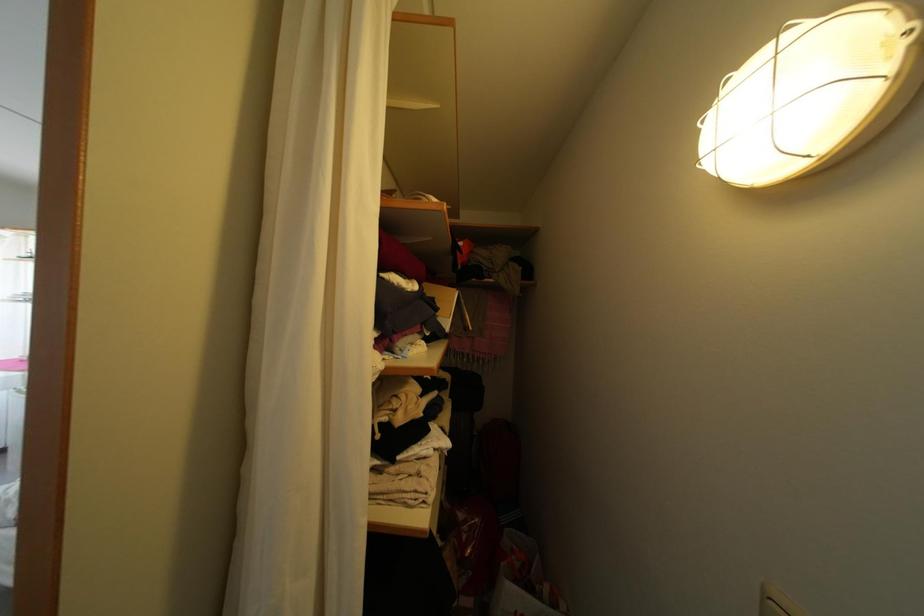
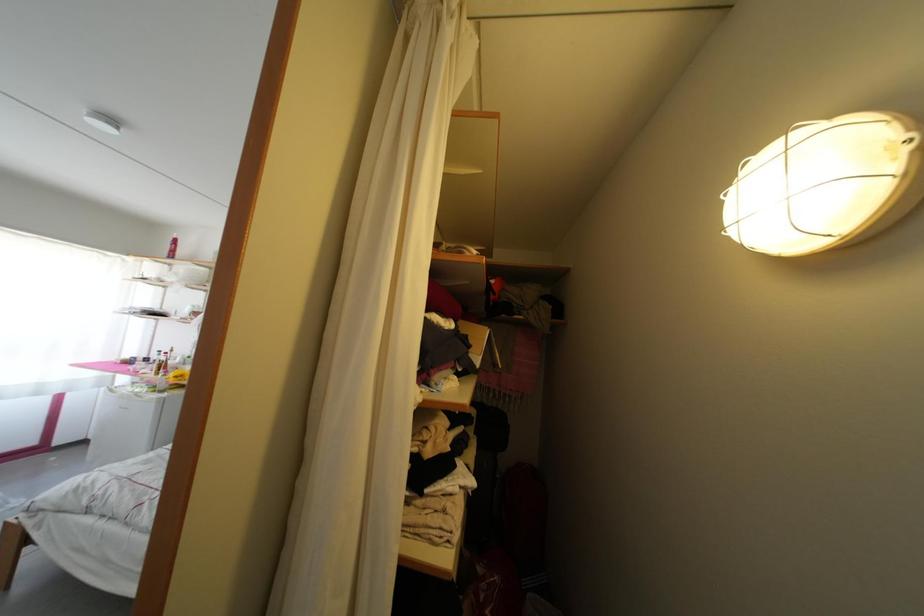
Question: In a continuous first-person perspective shot, in which direction is the camera moving?

Choices:
 (A) Left
 (B) Right
 (C) Forward
 (D) Backward

Answer: (D)